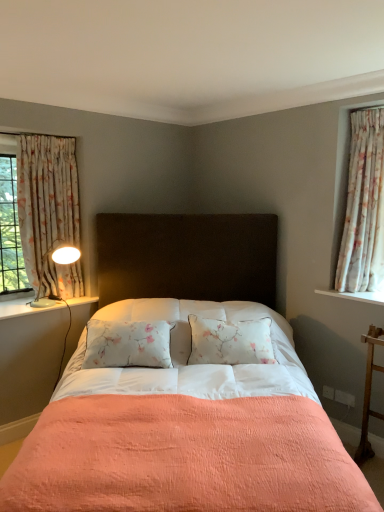
You are a GUI agent. You are given a task and a screenshot of the screen. Output one action in this format:
    pyautogui.click(x=<x>, y=<y>)
    Task: Click on the floral fabric curtain at left, which appears as the 1th curtain when viewed from the left
    
    Given the screenshot: What is the action you would take?
    pyautogui.click(x=46, y=198)

How far apart are white glossy lamp at left and floral fabric curtain at left, the second curtain in the right-to-left sequence?

white glossy lamp at left is 12.35 inches from floral fabric curtain at left, the second curtain in the right-to-left sequence.

Is white glossy lamp at left aimed at floral fabric curtain at left, the second curtain in the right-to-left sequence?

No, white glossy lamp at left is not turned towards floral fabric curtain at left, the second curtain in the right-to-left sequence.

In the scene shown: Is white glossy lamp at left positioned beyond the bounds of floral fabric curtain at left, the second curtain in the right-to-left sequence?

No, white glossy lamp at left is not outside of floral fabric curtain at left, the second curtain in the right-to-left sequence.

Does white glossy lamp at left lie behind floral fabric curtain at left, the second curtain in the right-to-left sequence?

No, it is in front of floral fabric curtain at left, the second curtain in the right-to-left sequence.

Looking at this image, can we say floral fabric curtain at right, the 1th curtain viewed from the right, lies outside peachy fabric bed at center?

Indeed, floral fabric curtain at right, the 1th curtain viewed from the right, is completely outside peachy fabric bed at center.

Which is more to the right, floral fabric curtain at right, the second curtain from the left, or peachy fabric bed at center?

floral fabric curtain at right, the second curtain from the left, is more to the right.

From the image's perspective, who appears lower, floral fabric curtain at right, the second curtain from the left, or peachy fabric bed at center?

peachy fabric bed at center is shown below in the image.

From a real-world perspective, relative to peachy fabric bed at center, is floral fabric curtain at right, the second curtain from the left, vertically above or below?

Clearly, from a real-world perspective, floral fabric curtain at right, the second curtain from the left, is above peachy fabric bed at center.

Is white glossy lamp at left positioned with its back to peachy fabric bed at center?

That's not correct — white glossy lamp at left is not looking away from peachy fabric bed at center.

In the scene shown: Who is taller, white glossy lamp at left or peachy fabric bed at center?

peachy fabric bed at center is taller.

Which is in front, point (47, 301) or point (249, 241)?

The point (249, 241) is closer to the camera.

From the image's perspective, who appears lower, white glossy lamp at left or peachy fabric bed at center?

peachy fabric bed at center, from the image's perspective.

Does floral fabric curtain at left, the second curtain in the right-to-left sequence, have a greater width compared to white painted wood at left?

No, floral fabric curtain at left, the second curtain in the right-to-left sequence, is not wider than white painted wood at left.

Is floral fabric curtain at left, the second curtain in the right-to-left sequence, positioned far away from white painted wood at left?

No, floral fabric curtain at left, the second curtain in the right-to-left sequence, is in close proximity to white painted wood at left.

From a real-world perspective, is floral fabric curtain at left, the second curtain in the right-to-left sequence, on white painted wood at left?

Indeed, from a real-world perspective, floral fabric curtain at left, the second curtain in the right-to-left sequence, stands above white painted wood at left.

In the image, is floral fabric curtain at left, the second curtain in the right-to-left sequence, positioned in front of or behind white painted wood at left?

floral fabric curtain at left, the second curtain in the right-to-left sequence, is behind white painted wood at left.

Is floral fabric curtain at left, which appears as the 1th curtain when viewed from the left, wider than white glossy lamp at left?

No, floral fabric curtain at left, which appears as the 1th curtain when viewed from the left, is not wider than white glossy lamp at left.

Does point (41, 170) lie behind point (60, 253)?

No, (41, 170) is in front of (60, 253).

The height and width of the screenshot is (512, 384). Find the location of `light fixture that is in front of the floral fabric curtain at left, which appears as the 1th curtain when viewed from the left`. light fixture that is in front of the floral fabric curtain at left, which appears as the 1th curtain when viewed from the left is located at coordinates (57, 263).

Is floral fabric curtain at left, the second curtain in the right-to-left sequence, further to camera compared to white glossy lamp at left?

Yes, it is behind white glossy lamp at left.

Considering the relative sizes of peachy fabric bed at center and white painted wood at left in the image provided, is peachy fabric bed at center smaller than white painted wood at left?

No.

Would you say peachy fabric bed at center is a long distance from white painted wood at left?

No, peachy fabric bed at center is in close proximity to white painted wood at left.

From a real-world perspective, is peachy fabric bed at center on top of white painted wood at left?

No, from a real-world perspective, peachy fabric bed at center is not over white painted wood at left

Between peachy fabric bed at center and white painted wood at left, which one is positioned in front?

peachy fabric bed at center.

Considering their positions, is white painted wood at left located in front of or behind peachy fabric bed at center?

Visually, white painted wood at left is located behind peachy fabric bed at center.

Is white painted wood at left positioned with its back to peachy fabric bed at center?

No, white painted wood at left's orientation is not away from peachy fabric bed at center.

You are a GUI agent. You are given a task and a screenshot of the screen. Output one action in this format:
    pyautogui.click(x=<x>, y=<y>)
    Task: Click on the window sill above the peachy fabric bed at center (from the image's perspective)
    This screenshot has height=512, width=384.
    Given the screenshot: What is the action you would take?
    pyautogui.click(x=24, y=308)

Locate an element on the screen. curtain on the left of white glossy lamp at left is located at coordinates (46, 198).

I want to click on the 2nd curtain above when counting from the peachy fabric bed at center (from the image's perspective), so click(x=364, y=206).

Based on their spatial positions, is floral fabric curtain at left, which appears as the 1th curtain when viewed from the left, or floral fabric curtain at right, the second curtain from the left, closer to white glossy lamp at left?

floral fabric curtain at left, which appears as the 1th curtain when viewed from the left, is closer to white glossy lamp at left.

Looking at the image, which one is located further to floral fabric curtain at left, the second curtain in the right-to-left sequence, white painted wood at left or white glossy lamp at left?

white painted wood at left lies further to floral fabric curtain at left, the second curtain in the right-to-left sequence, than the other object.

Looking at the image, which one is located closer to floral fabric curtain at left, which appears as the 1th curtain when viewed from the left, peachy fabric bed at center or floral fabric curtain at right, the second curtain from the left?

Among the two, peachy fabric bed at center is located nearer to floral fabric curtain at left, which appears as the 1th curtain when viewed from the left.

Estimate the real-world distances between objects in this image. Which object is closer to white glossy lamp at left, floral fabric curtain at right, the 1th curtain viewed from the right, or floral fabric curtain at left, the second curtain in the right-to-left sequence?

floral fabric curtain at left, the second curtain in the right-to-left sequence, is positioned closer to the anchor white glossy lamp at left.

Estimate the real-world distances between objects in this image. Which object is further from peachy fabric bed at center, white painted wood at left or floral fabric curtain at left, the second curtain in the right-to-left sequence?

The object further to peachy fabric bed at center is floral fabric curtain at left, the second curtain in the right-to-left sequence.

From the image, which object appears to be farther from white painted wood at left, floral fabric curtain at left, which appears as the 1th curtain when viewed from the left, or floral fabric curtain at right, the second curtain from the left?

Among the two, floral fabric curtain at right, the second curtain from the left, is located further to white painted wood at left.

Considering their positions, is floral fabric curtain at left, the second curtain in the right-to-left sequence, positioned closer to floral fabric curtain at right, the second curtain from the left, than white glossy lamp at left?

white glossy lamp at left lies closer to floral fabric curtain at right, the second curtain from the left, than the other object.

In the scene shown: From the image, which object appears to be nearer to floral fabric curtain at left, which appears as the 1th curtain when viewed from the left, white painted wood at left or peachy fabric bed at center?

white painted wood at left lies closer to floral fabric curtain at left, which appears as the 1th curtain when viewed from the left, than the other object.

At what (x,y) coordinates should I click in order to perform the action: click on curtain between white painted wood at left and floral fabric curtain at right, the 1th curtain viewed from the right, in the horizontal direction. Please return your answer as a coordinate pair (x, y). The height and width of the screenshot is (512, 384). Looking at the image, I should click on (46, 198).

At what (x,y) coordinates should I click in order to perform the action: click on window sill located between peachy fabric bed at center and white glossy lamp at left in the depth direction. Please return your answer as a coordinate pair (x, y). The image size is (384, 512). Looking at the image, I should click on point(24,308).

Locate an element on the screen. The height and width of the screenshot is (512, 384). light fixture between floral fabric curtain at left, which appears as the 1th curtain when viewed from the left, and white painted wood at left vertically is located at coordinates (57, 263).

The width and height of the screenshot is (384, 512). In order to click on window sill between peachy fabric bed at center and floral fabric curtain at left, the second curtain in the right-to-left sequence, in the front-back direction in this screenshot , I will do `click(24, 308)`.